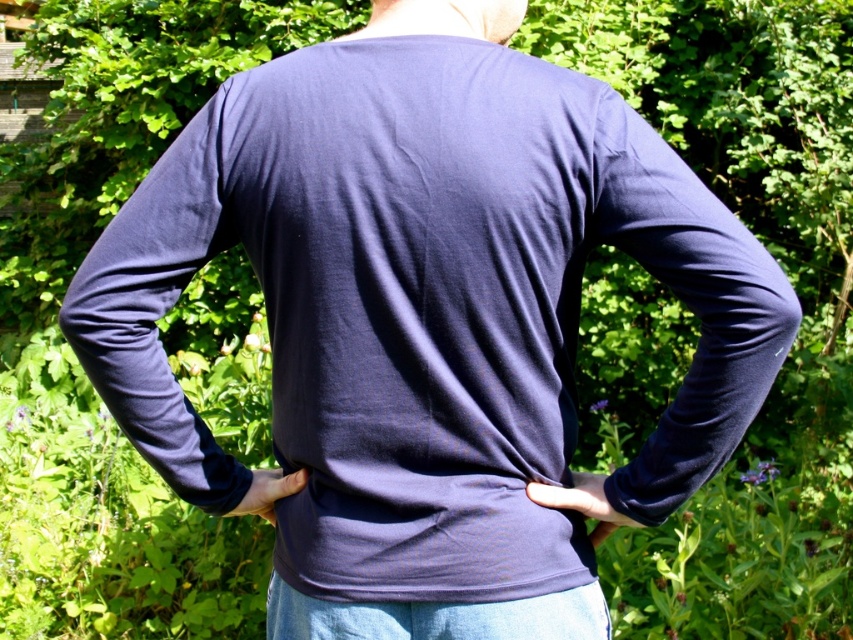
Question: Is navy blue fabric at center bigger than matte blue fabric at center?

Choices:
 (A) yes
 (B) no

Answer: (A)

Question: Which object is the closest to the matte blue fabric at center?

Choices:
 (A) matte black hand at center
 (B) navy blue fabric at center

Answer: (B)

Question: Can you confirm if navy blue fabric at center is positioned to the left of matte black hand at center?

Choices:
 (A) no
 (B) yes

Answer: (B)

Question: Which point is farther to the camera?

Choices:
 (A) matte blue fabric at center
 (B) matte black hand at center
 (C) navy blue fabric at center

Answer: (A)

Question: From the image, what is the correct spatial relationship of matte black hand at center in relation to matte blue fabric at center?

Choices:
 (A) left
 (B) right

Answer: (B)

Question: Which object appears farthest from the camera in this image?

Choices:
 (A) matte black hand at center
 (B) navy blue fabric at center
 (C) matte blue fabric at center

Answer: (C)